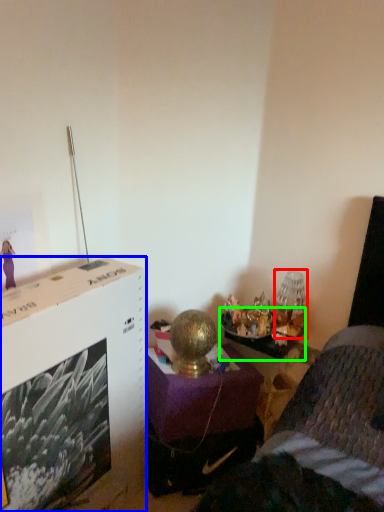
Question: Based on their relative distances, which object is farther from table lamp (highlighted by a red box)? Choose from file cabinet (highlighted by a blue box) and table (highlighted by a green box).

Choices:
 (A) file cabinet
 (B) table

Answer: (A)